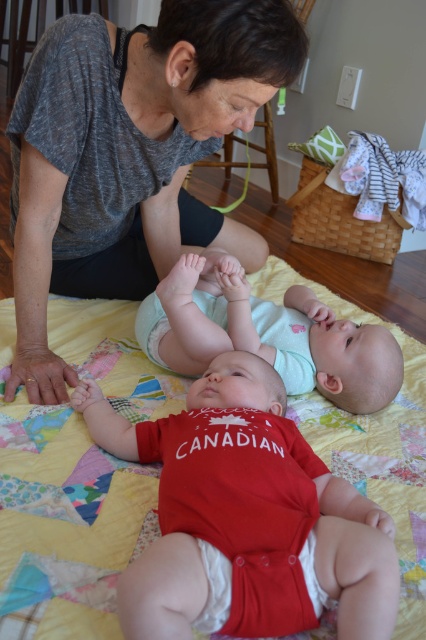
You are a parent trying to place a new toy between the matte red onesie at center and the light blue fabric diaper at center. The toy requires a minimum of 30 centimeters of space to be placed safely. Based on the scene, can you fit the toy between them?

The distance between the matte red onesie at center and the light blue fabric diaper at center is 30.94 centimeters, which is just enough to fit the toy requiring 30 centimeters of space.

You are a photographer trying to capture a clear shot of the white cloth diaper at lower center. However, the gray textured shirt at upper left is blocking your view. Can you adjust your angle to see the diaper without moving any objects?

The gray textured shirt at upper left is positioned over the white cloth diaper at lower center, so adjusting your angle might not help since the shirt is directly blocking the diaper. You might need to reposition the shirt or move the camera to a different side to get an unobstructed view.

You are a photographer setting up a camera to capture the scene. You need to ensure that the gray textured shirt at upper left and the light blue fabric diaper at center are both visible in the frame. Given their sizes, which object should you prioritize keeping in the center of the frame to ensure it doesn t get cropped out?

The gray textured shirt at upper left should be prioritized in the center of the frame because it is wider than the light blue fabric diaper at center, making it more likely to be cropped out if not centered properly.